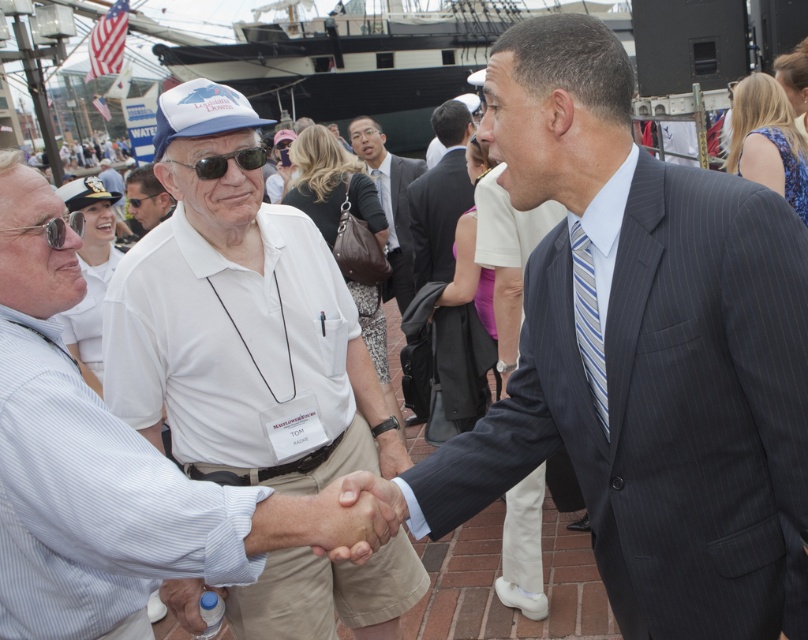
Is white matte shirt at center below sunglasses at center?

Indeed, white matte shirt at center is positioned under sunglasses at center.

Does point (59, 632) lie in front of point (182, 164)?

Yes, point (59, 632) is closer to viewer.

The width and height of the screenshot is (808, 640). What do you see at coordinates (154, 504) in the screenshot? I see `white matte shirt at center` at bounding box center [154, 504].

Where is `white matte shirt at center`? Image resolution: width=808 pixels, height=640 pixels. white matte shirt at center is located at coordinates (154, 504).

Measure the distance between dark gray pinstripe suit at center and camera.

dark gray pinstripe suit at center is 2.94 meters away from camera.

Is dark gray pinstripe suit at center below matte white cap at center?

Yes.

Is point (722, 184) closer to camera compared to point (160, 186)?

Yes, it is.

Locate an element on the screen. dark gray pinstripe suit at center is located at coordinates (642, 356).

Is point (20, 445) positioned behind point (163, 196)?

No, (20, 445) is in front of (163, 196).

Is white matte shirt at center smaller than matte white cap at center?

Correct, white matte shirt at center occupies less space than matte white cap at center.

You are a GUI agent. You are given a task and a screenshot of the screen. Output one action in this format:
    pyautogui.click(x=<x>, y=<y>)
    Task: Click on the white matte shirt at center
    
    Given the screenshot: What is the action you would take?
    pyautogui.click(x=154, y=504)